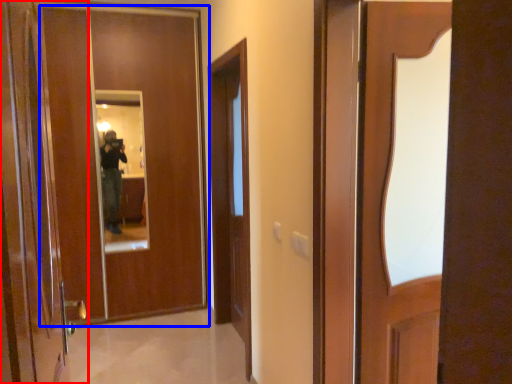
Question: Which point is further to the camera, door (highlighted by a red box) or door (highlighted by a blue box)?

Choices:
 (A) door
 (B) door

Answer: (B)